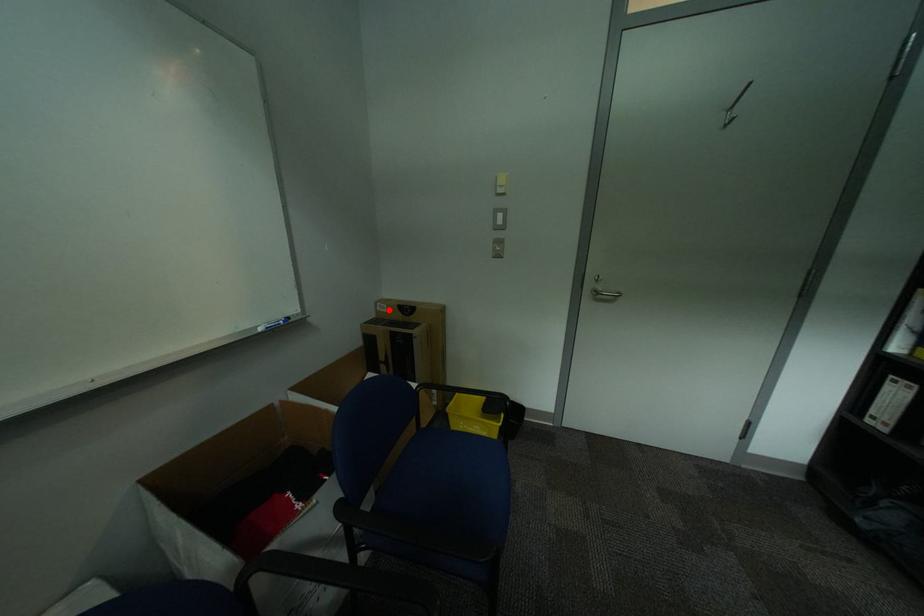
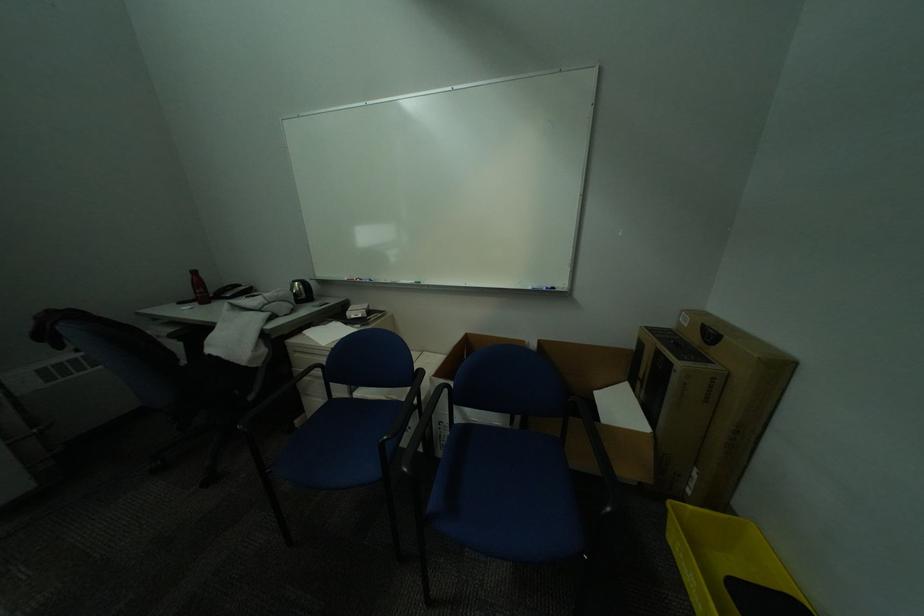
Where in the second image is the point corresponding to the highlighted location from the first image?

(691, 321)